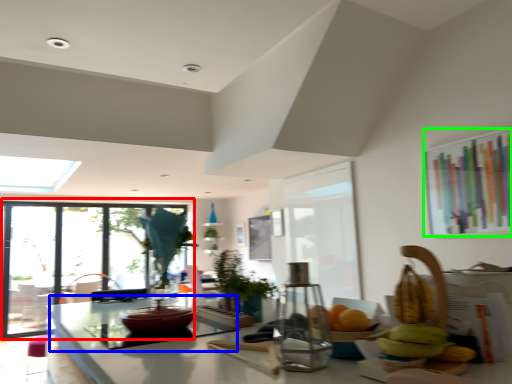
Question: Which object is positioned closest to window (highlighted by a red box)? Select from glass table (highlighted by a blue box) and window screen (highlighted by a green box).

Choices:
 (A) glass table
 (B) window screen

Answer: (A)